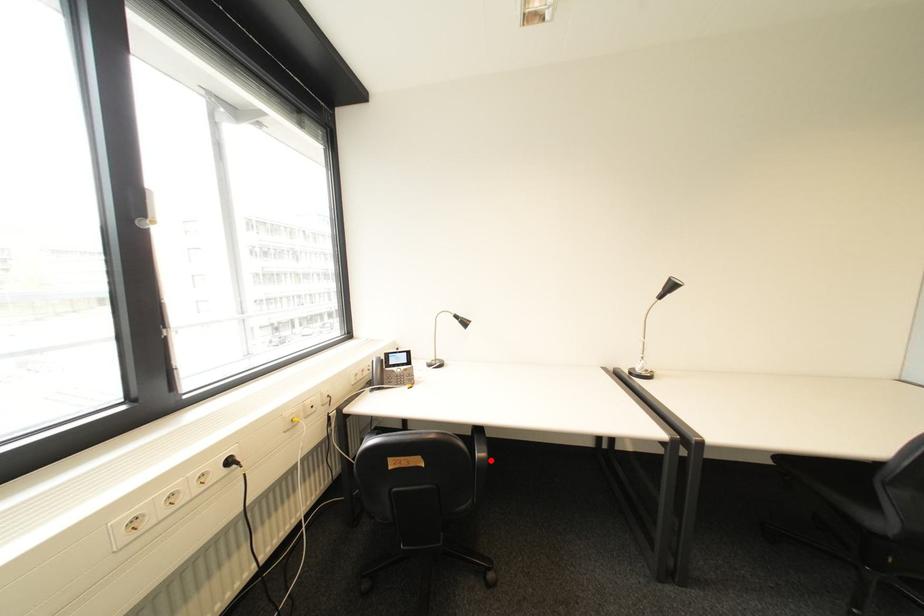
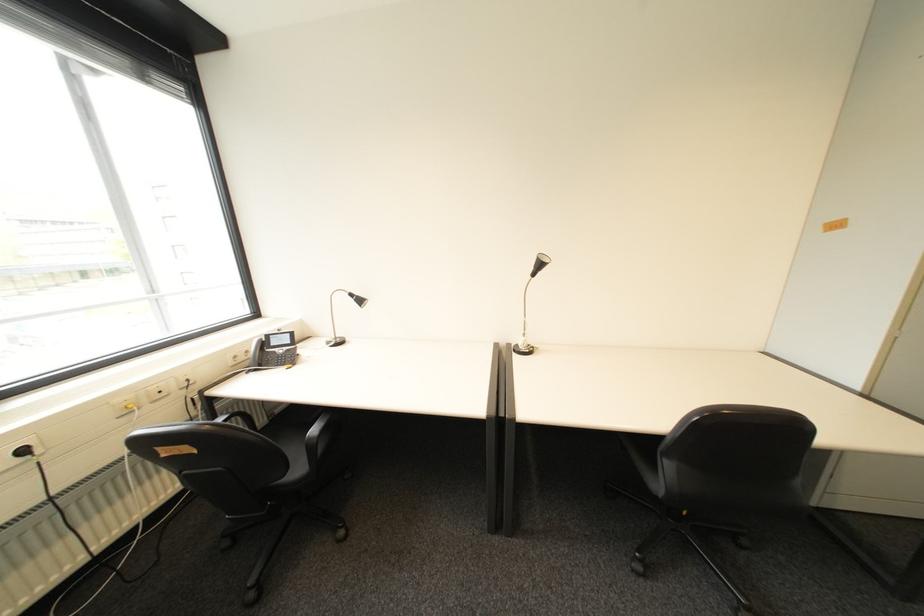
The point at the highlighted location is marked in the first image. Where is the corresponding point in the second image?

(321, 439)